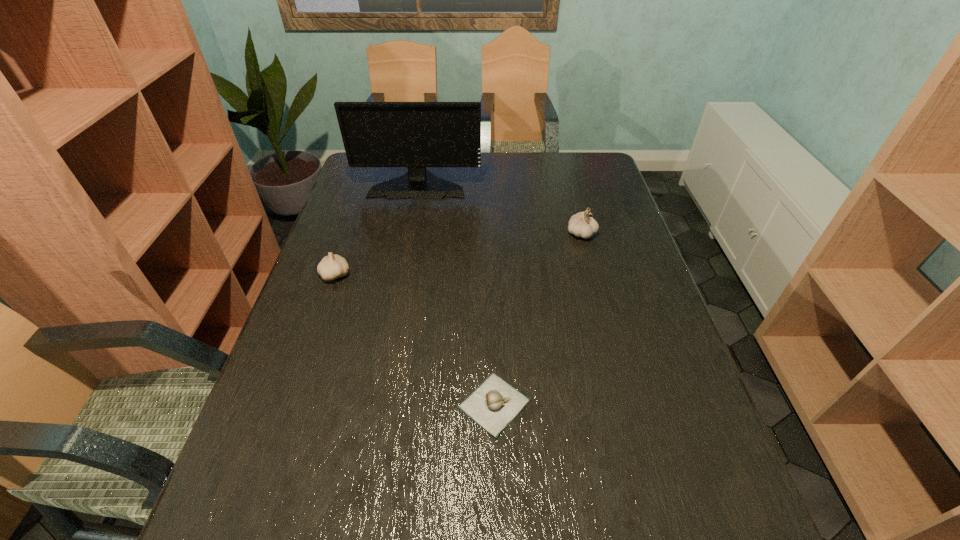
Identify the location of free location at the far right corner of the desktop. This screenshot has width=960, height=540. [583, 183].

Locate an element on the screen. vacant space that's between the farthest object and the rightmost garlic is located at coordinates (499, 209).

Find the location of a particular element. vacant space that's between the third shortest object and the tallest object is located at coordinates (499, 209).

Find the location of `vacant space that is in between the second garlic from left to right and the rightmost garlic`. vacant space that is in between the second garlic from left to right and the rightmost garlic is located at coordinates (538, 319).

This screenshot has width=960, height=540. What are the coordinates of `vacant space in between the leftmost garlic and the monitor` in the screenshot? It's located at (377, 230).

Locate an element on the screen. vacant space that is in between the rightmost object and the farthest object is located at coordinates (499, 209).

This screenshot has width=960, height=540. In order to click on free space between the leftmost garlic and the tallest object in this screenshot , I will do `click(377, 230)`.

The height and width of the screenshot is (540, 960). I want to click on unoccupied area between the second farthest object and the second garlic from left to right, so click(x=538, y=319).

This screenshot has width=960, height=540. I want to click on vacant space that is in between the second tallest object and the nearest object, so click(538, 319).

Where is `free space between the third farthest object and the second farthest object`? free space between the third farthest object and the second farthest object is located at coordinates (459, 254).